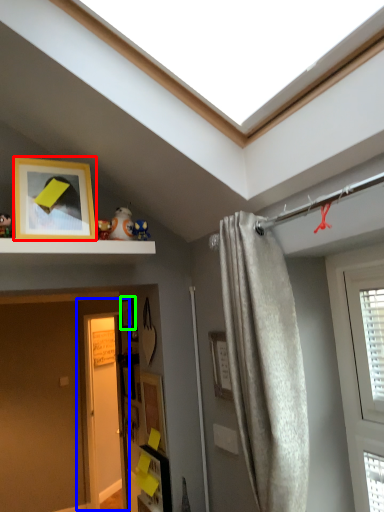
Question: Considering the real-world distances, which object is closest to picture frame (highlighted by a red box)? door (highlighted by a blue box) or picture frame (highlighted by a green box).

Choices:
 (A) door
 (B) picture frame

Answer: (B)